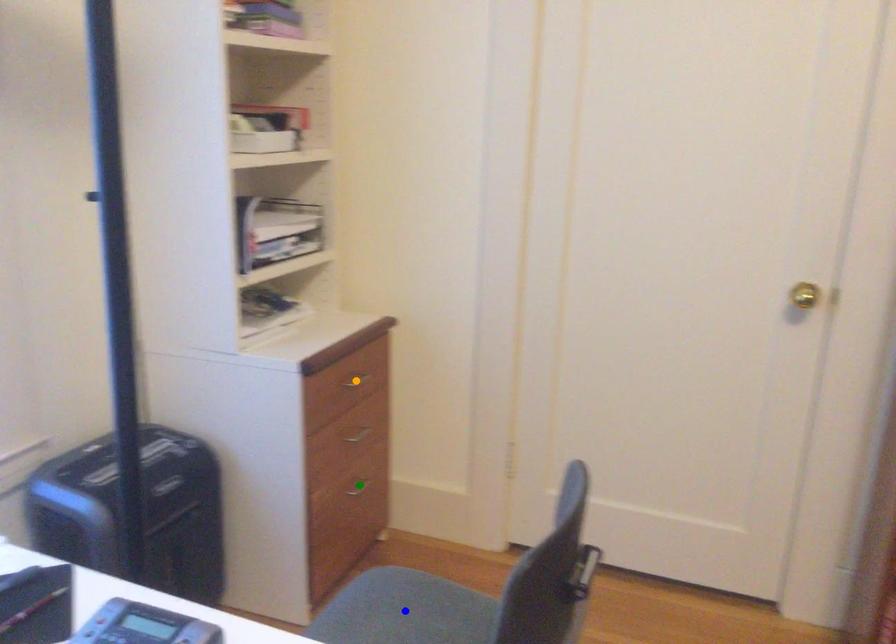
Order these from farthest to nearest:
green point, orange point, blue point

green point, orange point, blue point